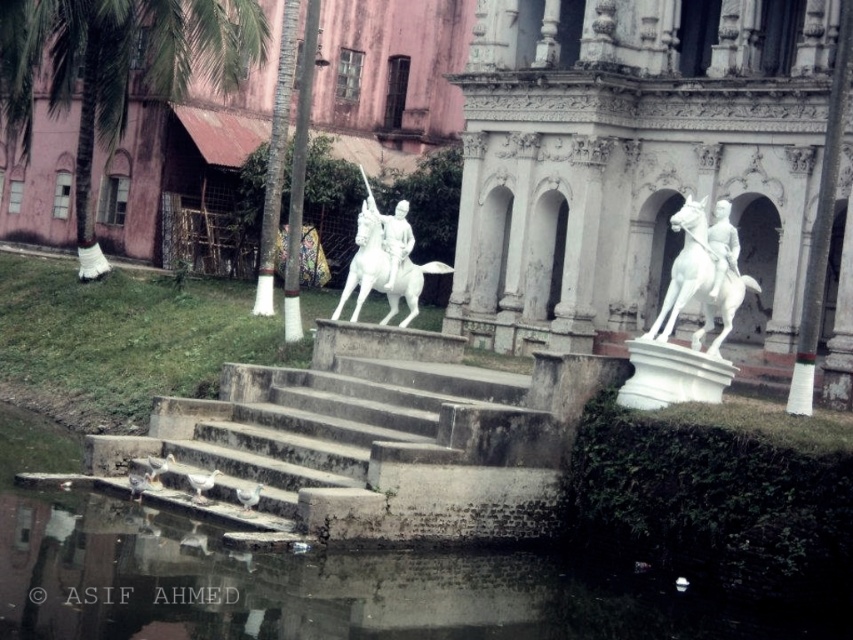
Can you confirm if green leafy palm tree at upper left is positioned above white marble horse at center?

Indeed, green leafy palm tree at upper left is positioned over white marble horse at center.

Between green leafy palm tree at upper left and white marble horse at center, which one is positioned lower?

white marble horse at center is lower down.

Between point (47, 10) and point (694, 340), which one is positioned in front?

Point (694, 340) is in front.

This screenshot has width=853, height=640. I want to click on green leafy palm tree at upper left, so click(x=115, y=70).

Does white glossy horse at center have a larger size compared to white marble statue at right?

Yes, white glossy horse at center is bigger than white marble statue at right.

Is point (357, 305) behind point (723, 236)?

Yes, it is behind point (723, 236).

I want to click on white glossy horse at center, so click(x=384, y=266).

Consider the image. Which is below, white marble statue at center or white glossy statue at center?

white glossy statue at center is lower down.

Does white marble statue at center have a greater width compared to white glossy statue at center?

Correct, the width of white marble statue at center exceeds that of white glossy statue at center.

Is point (715, 176) more distant than point (370, 205)?

Yes, point (715, 176) is behind point (370, 205).

Where is `white marble statue at center`? This screenshot has width=853, height=640. white marble statue at center is located at coordinates (633, 160).